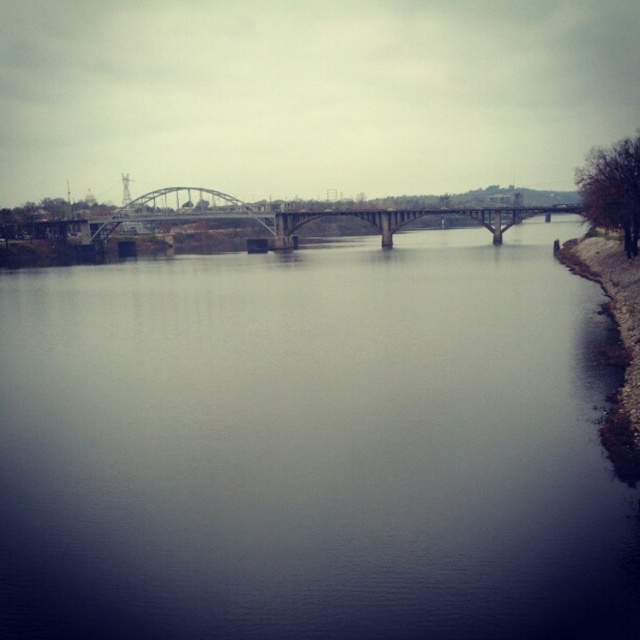
Question: Is gray concrete river at center further to the viewer compared to metallic gray bridge at center?

Choices:
 (A) no
 (B) yes

Answer: (A)

Question: Is gray concrete river at center closer to the viewer compared to metallic gray bridge at center?

Choices:
 (A) yes
 (B) no

Answer: (A)

Question: Does gray concrete river at center have a smaller size compared to metallic gray bridge at center?

Choices:
 (A) yes
 (B) no

Answer: (A)

Question: Which point is closer to the camera?

Choices:
 (A) (259, 221)
 (B) (397, 592)

Answer: (B)

Question: Which point is closer to the camera?

Choices:
 (A) (266, 458)
 (B) (262, 212)

Answer: (A)

Question: Which point appears farthest from the camera in this image?

Choices:
 (A) (568, 600)
 (B) (80, 220)

Answer: (B)